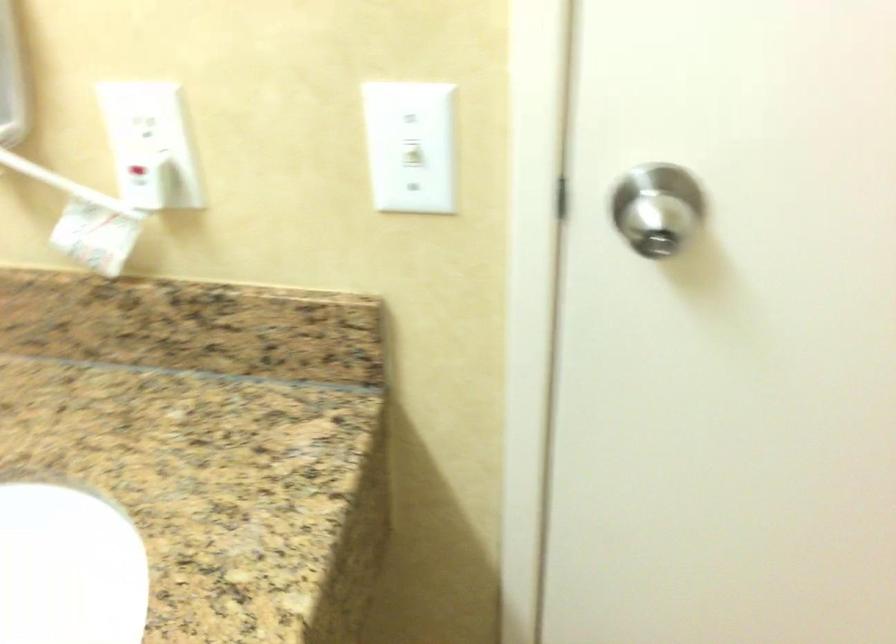
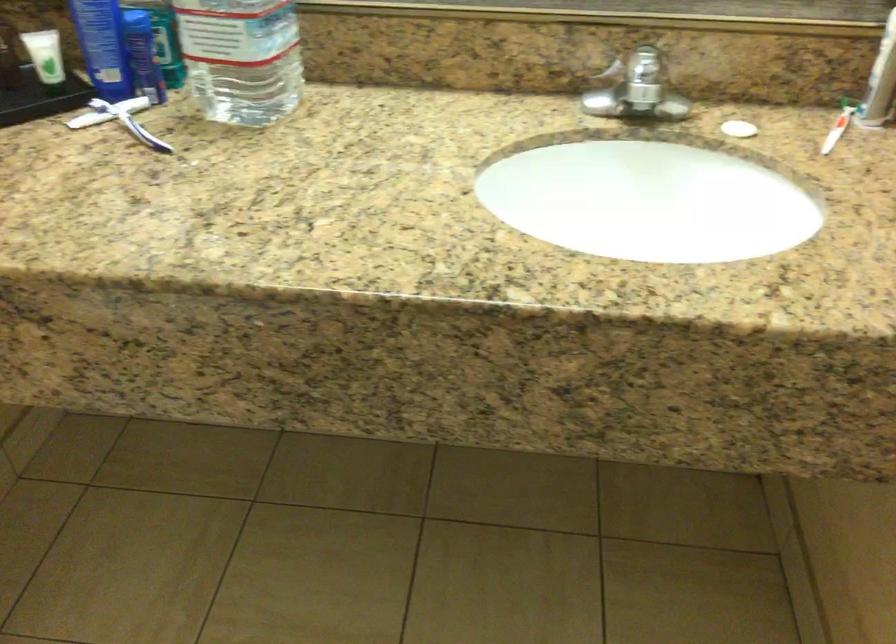
First-person continuous shooting, in which direction is the camera rotating?

The camera's rotation is toward left-down.